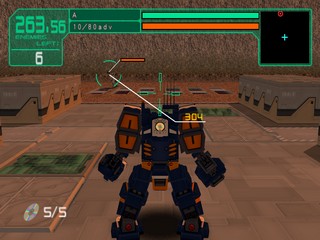
The height and width of the screenshot is (240, 320). What are the coordinates of `green floor tiles` in the screenshot? It's located at (51, 164), (213, 112).